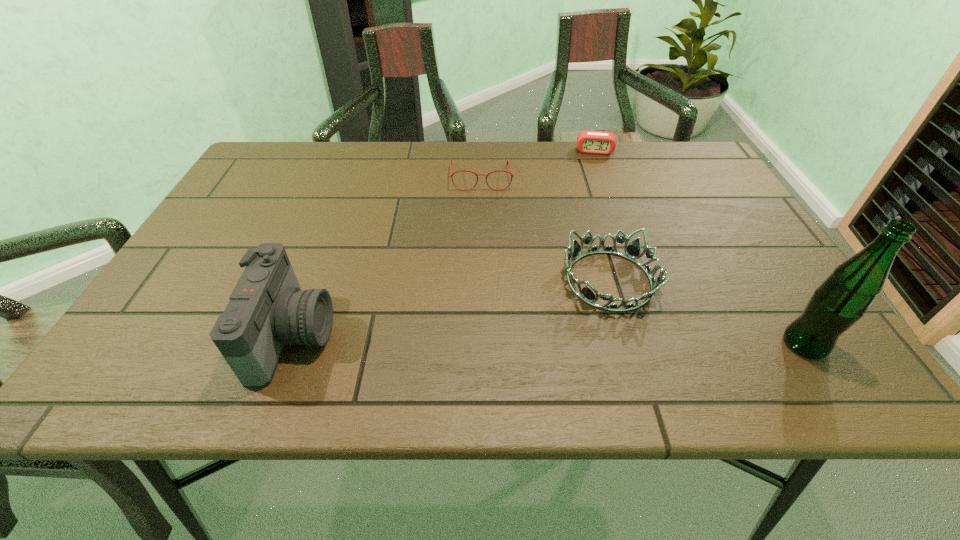
The width and height of the screenshot is (960, 540). I want to click on vacant space on the desktop that is between the leftmost object and the tallest object and is positioned on the front-facing side of the farthest object, so click(x=608, y=341).

I want to click on vacant spot on the desktop that is between the camera and the beer bottle and is positioned on the front-facing side of the third shortest object, so click(549, 340).

At what (x,y) coordinates should I click in order to perform the action: click on free space on the desktop that is between the camera and the beer bottle and is positioned on the face of the fourth nearest object. Please return your answer as a coordinate pair (x, y). This screenshot has width=960, height=540. Looking at the image, I should click on (487, 339).